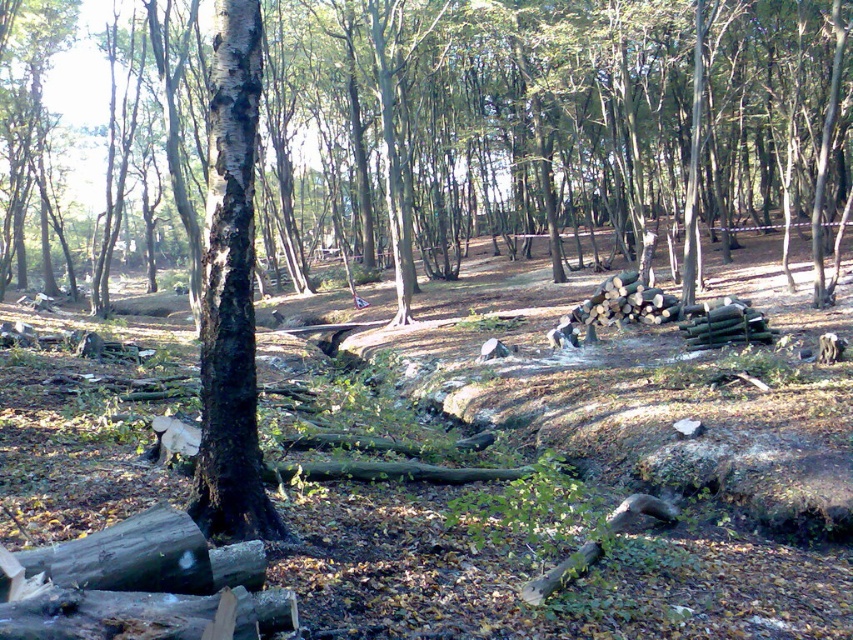
In the scene shown: You are a hiker trying to navigate through the forest. You see a brown rough bark tree at center and a black rough bark tree at center. Which tree is closer to you?

The brown rough bark tree at center is closer to you because the black rough bark tree at center is behind it.

You are a park ranger assessing the forest. You notice two trees at the center of the forest, a brown rough bark tree at center and a black rough bark tree at center. Which tree has a wider trunk?

The brown rough bark tree at center has a wider trunk than the black rough bark tree at center, as its width surpasses the latter.

You are a hiker who wants to identify the bigger tree to rest against. Which tree should you choose between the brown rough bark tree at center and the black rough bark tree at center?

The brown rough bark tree at center is larger in size than the black rough bark tree at center, so you should choose the brown rough bark tree at center to rest against.